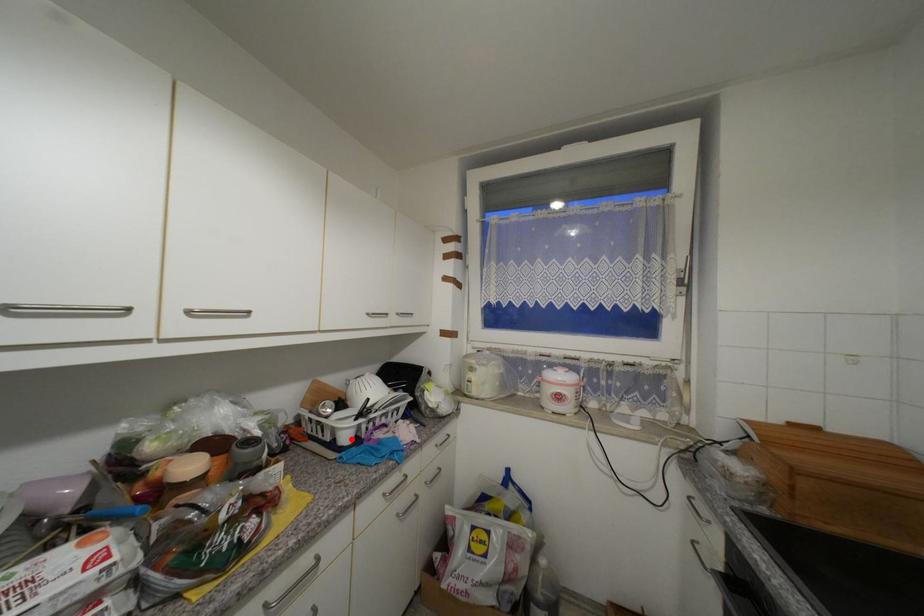
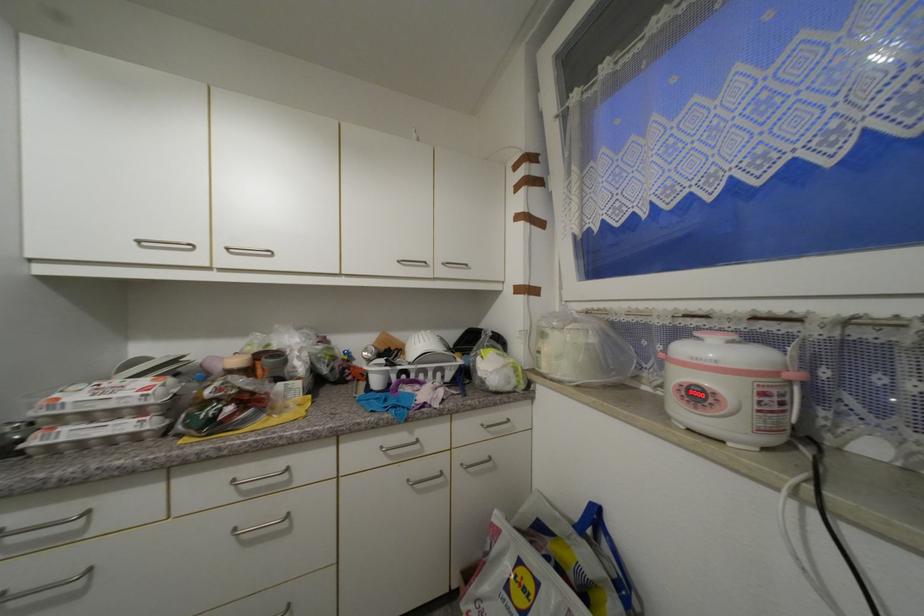
In the second image, find the point that corresponds to the highlighted location in the first image.

(382, 384)